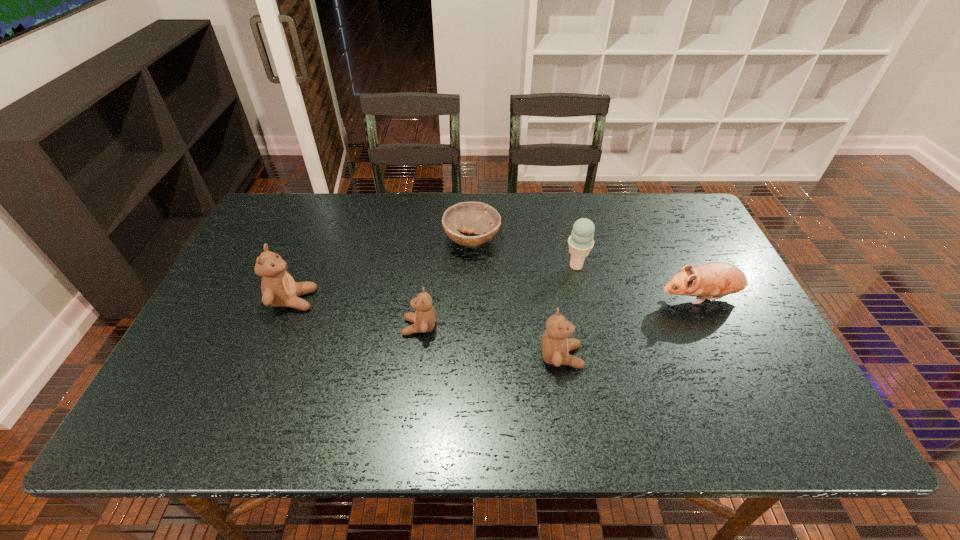
You are a GUI agent. You are given a task and a screenshot of the screen. Output one action in this format:
    pyautogui.click(x=<x>, y=<y>)
    Task: Click on the closest teddy bear relative to the ice cream
    This screenshot has width=960, height=540.
    Given the screenshot: What is the action you would take?
    pyautogui.click(x=555, y=346)

Where is `vacant space that satisfies the following two spatial constraints: 1. on the front side of the ice cream; 2. on the front-facing side of the leftmost object`? The height and width of the screenshot is (540, 960). vacant space that satisfies the following two spatial constraints: 1. on the front side of the ice cream; 2. on the front-facing side of the leftmost object is located at coordinates (584, 300).

This screenshot has width=960, height=540. Find the location of `blank area in the image that satisfies the following two spatial constraints: 1. on the front side of the fourth object from right to left; 2. on the left side of the ice cream`. blank area in the image that satisfies the following two spatial constraints: 1. on the front side of the fourth object from right to left; 2. on the left side of the ice cream is located at coordinates (471, 266).